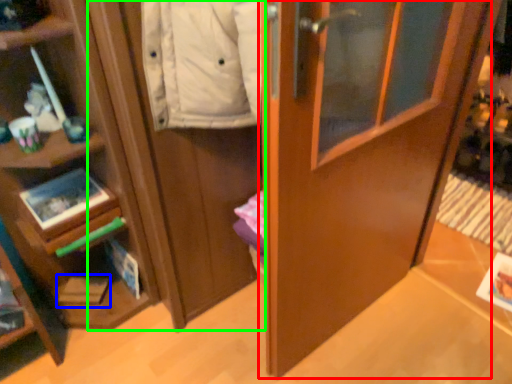
Question: Estimate the real-world distances between objects in this image. Which object is closer to door (highlighted by a red box), magazine (highlighted by a blue box) or cabinetry (highlighted by a green box)?

Choices:
 (A) magazine
 (B) cabinetry

Answer: (B)